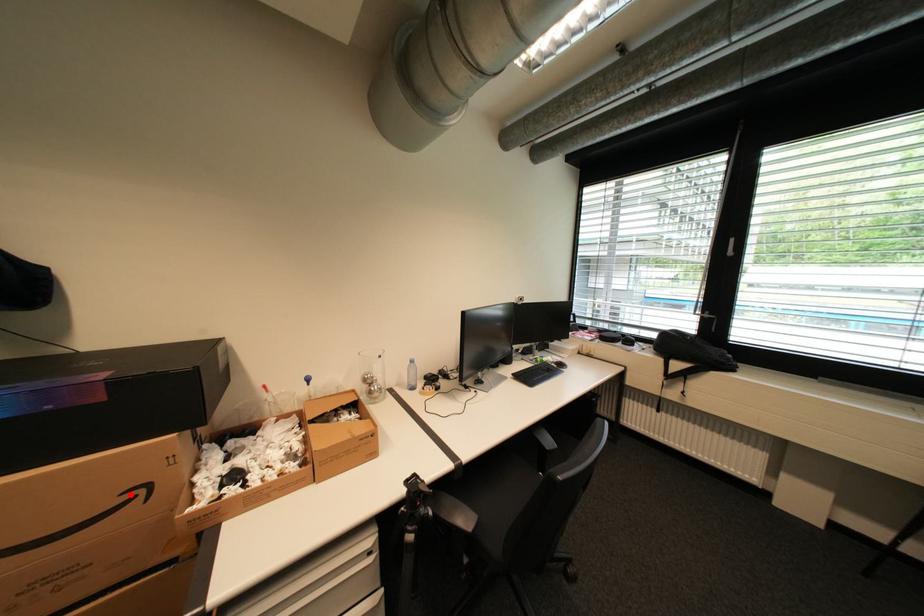
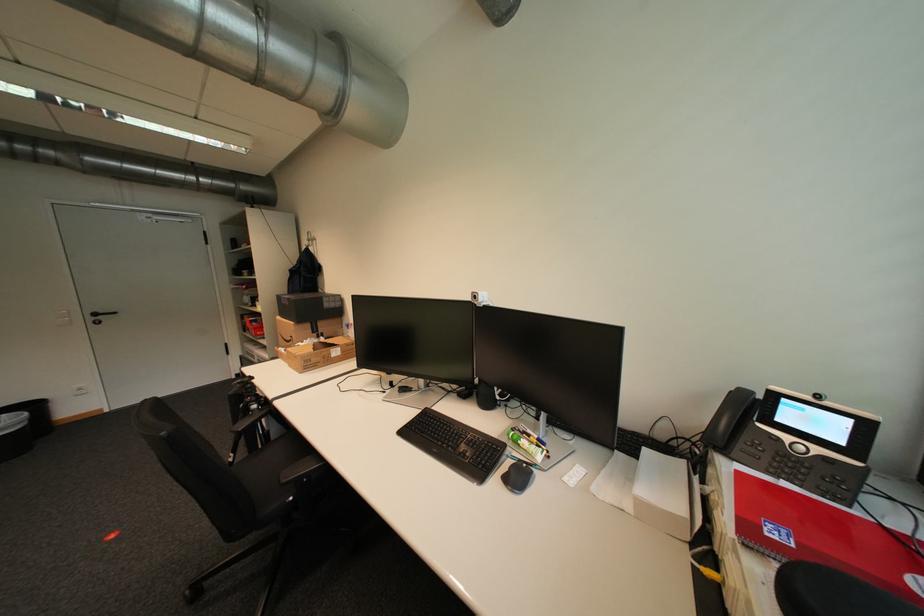
The point at the highlighted location is marked in the first image. Where is the corresponding point in the second image?

(299, 338)